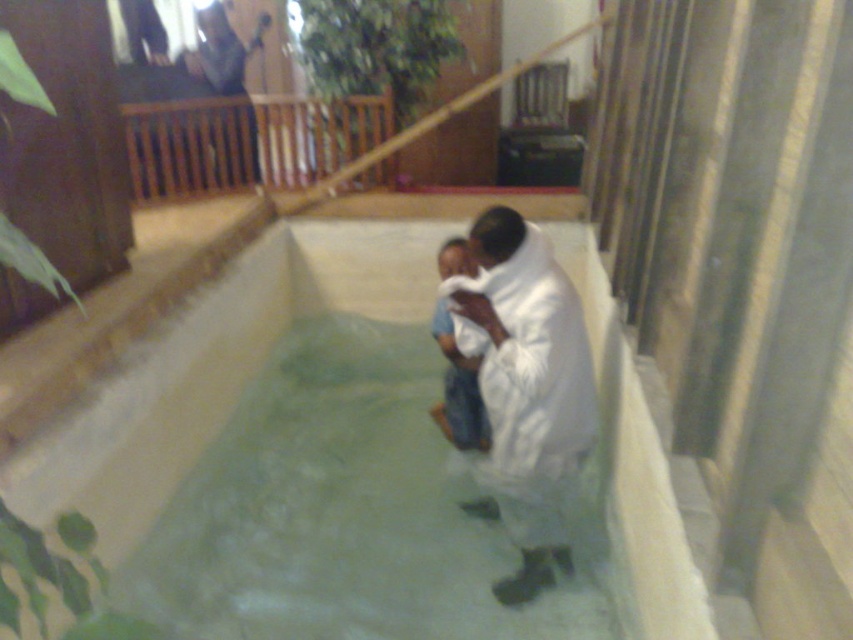
Question: Is brown wooden balustrade at upper left bigger than matte black dress at upper center?

Choices:
 (A) yes
 (B) no

Answer: (A)

Question: In this image, where is white fluffy blanket at center located relative to white cotton cloth at center?

Choices:
 (A) above
 (B) below

Answer: (B)

Question: Which point is closer to the camera?

Choices:
 (A) (506, 381)
 (B) (229, 172)

Answer: (A)

Question: Which is nearer to the brown wooden balustrade at upper left?

Choices:
 (A) matte black dress at upper center
 (B) white cotton cloth at center
 (C) white fabric at center
 (D) white fluffy blanket at center

Answer: (A)

Question: Can you confirm if white cotton cloth at center is bigger than matte black dress at upper center?

Choices:
 (A) yes
 (B) no

Answer: (B)

Question: Which is farther from the brown wooden balustrade at upper left?

Choices:
 (A) white fluffy blanket at center
 (B) matte black dress at upper center
 (C) white fabric at center

Answer: (A)